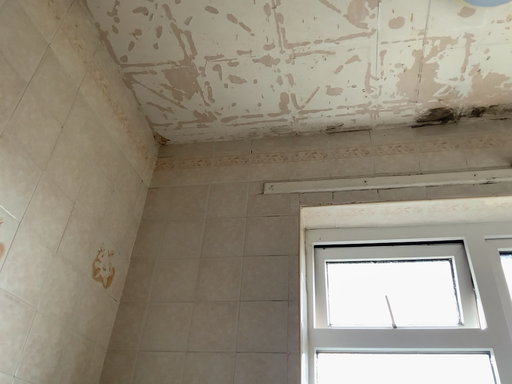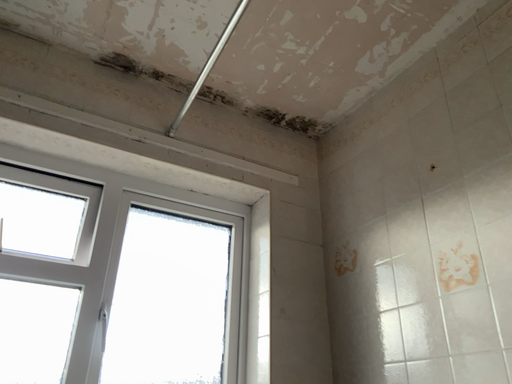
Question: How did the camera likely rotate when shooting the video?

Choices:
 (A) rotated right
 (B) rotated left

Answer: (A)